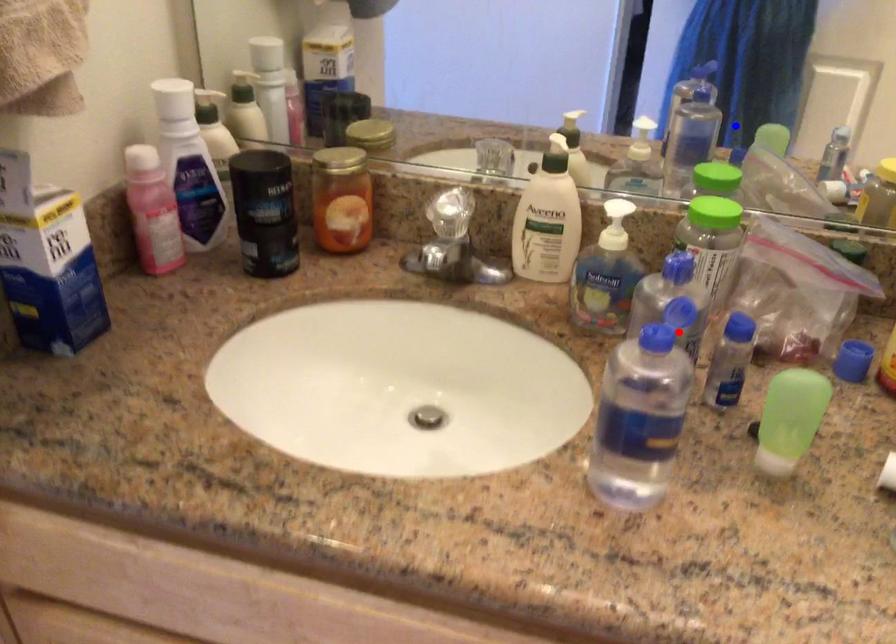
Question: In the image, two points are highlighted. Which point is nearer to the camera? Reply with the corresponding letter.

Choices:
 (A) blue point
 (B) red point

Answer: (B)